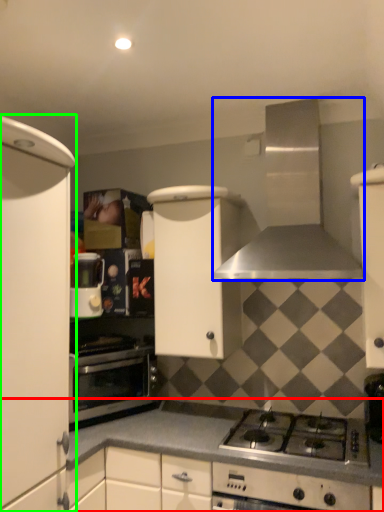
Question: Which is farther away from countertop (highlighted by a red box)? kitchen appliance (highlighted by a blue box) or cabinetry (highlighted by a green box)?

Choices:
 (A) kitchen appliance
 (B) cabinetry

Answer: (A)